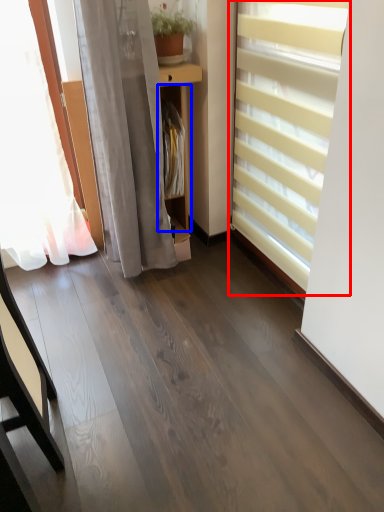
Question: Among these objects, which one is farthest to the camera, window blind (highlighted by a red box) or shelf (highlighted by a blue box)?

Choices:
 (A) window blind
 (B) shelf

Answer: (B)